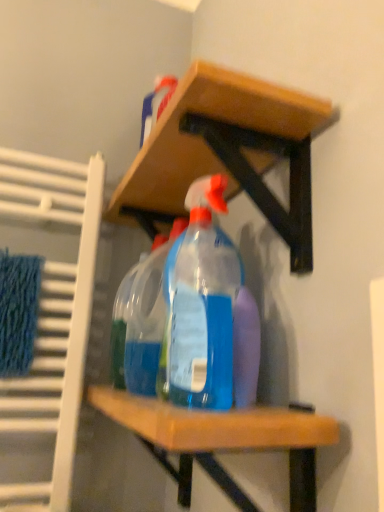
Locate an element on the screen. free space to the right of transparent plastic spray bottle at center, marked as the first bottle in a front-to-back arrangement is located at coordinates (270, 408).